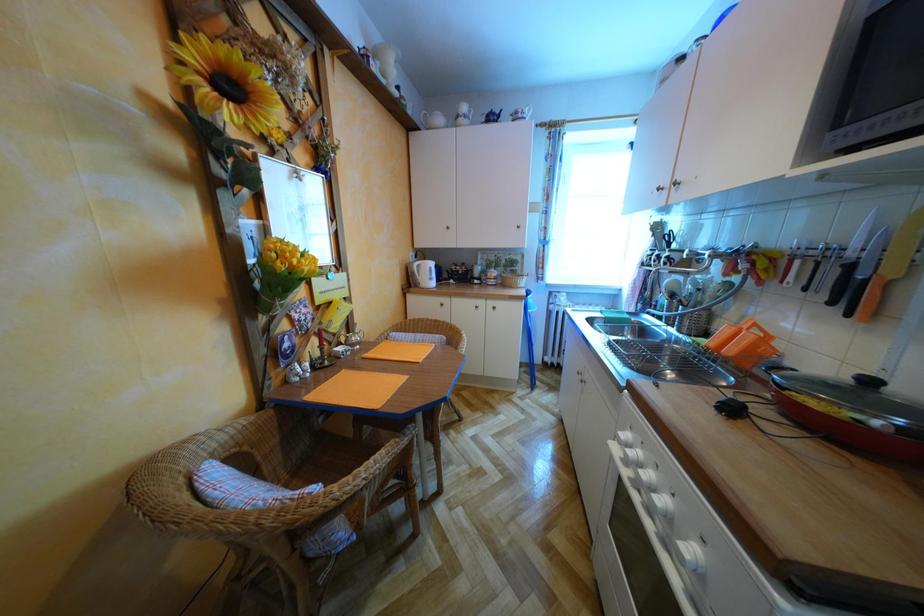
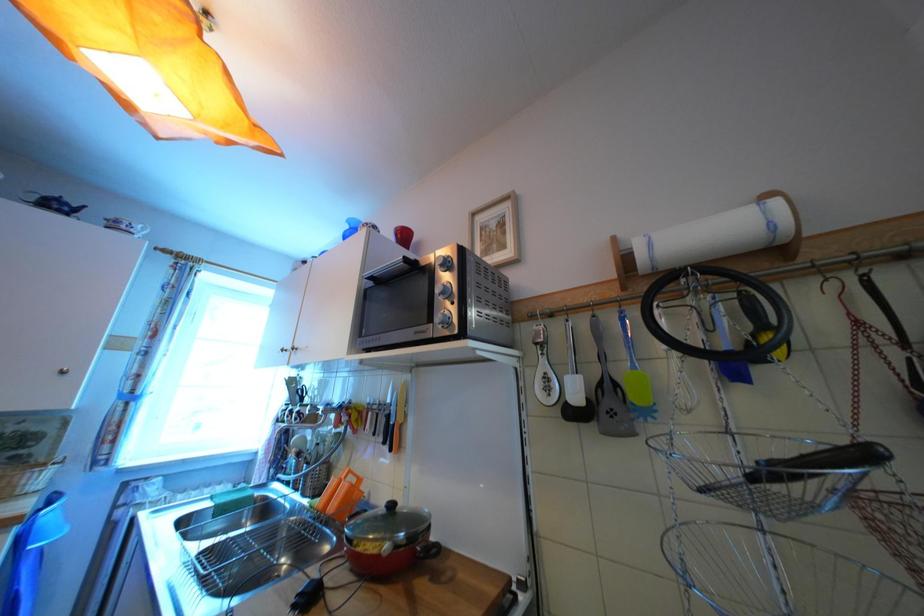
Based on the photo, the first image is from the beginning of the video and the second image is from the end. How did the camera likely rotate when shooting the video?

The rotation direction of the camera is right-up.